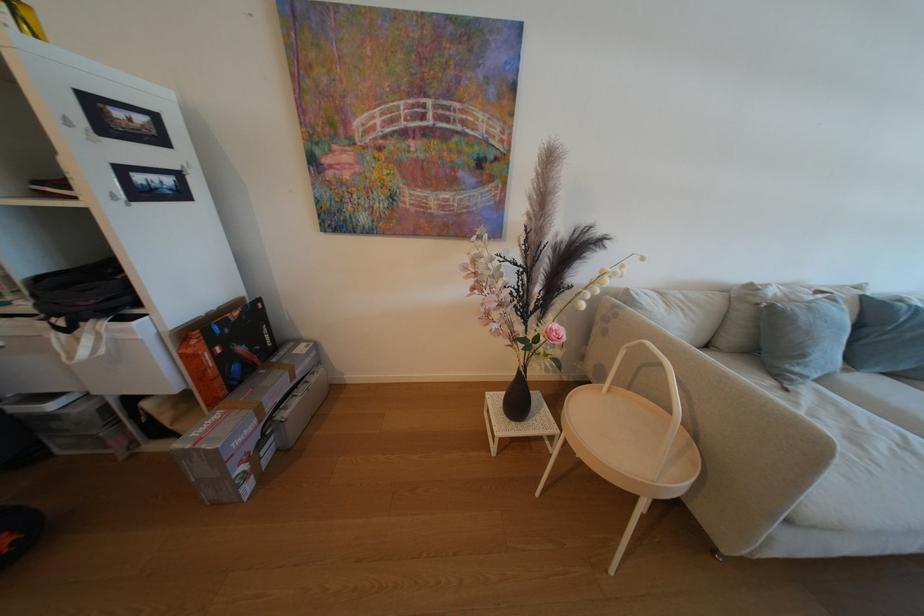
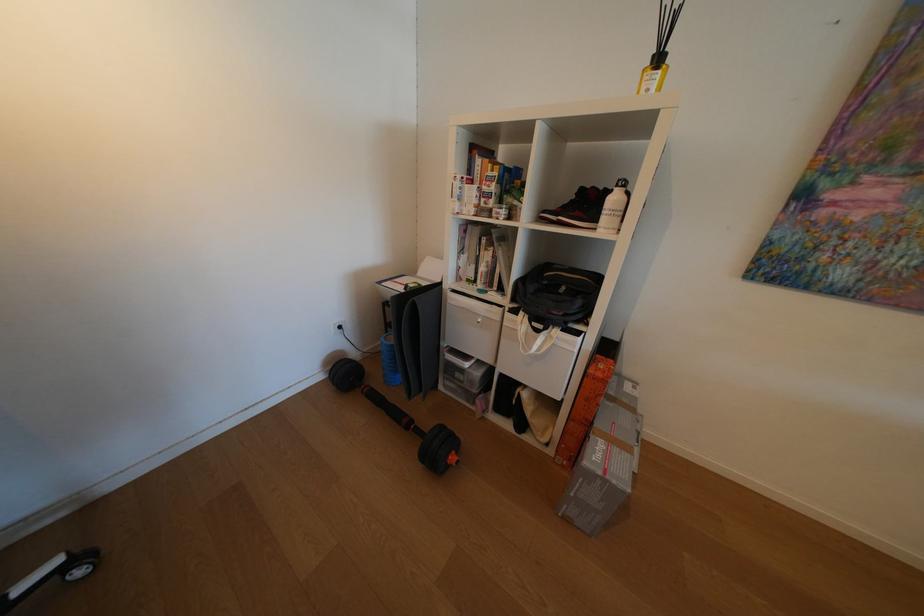
Find the pixel in the second image that matches (201,353) in the first image.

(611, 376)